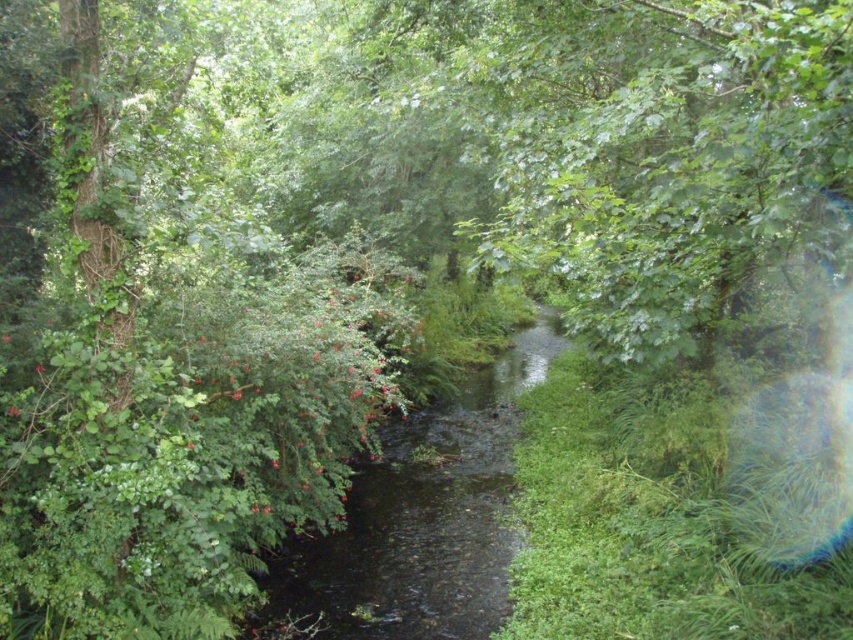
You are a gardener who needs to place a 5 meter long wooden bridge over the green leafy stream at center. You also want to ensure that the glossy red flower at left remains visible from the bridge. Can you do this without moving the flower?

The green leafy stream at center and glossy red flower at left are 5.16 meters apart. Since the bridge is 5 meters long, there will be a small gap of 0.16 meters between them, so the glossy red flower at left will still be visible from the bridge without needing to move it.

You are standing at point A located at point (351, 628). You want to walk to point B, which is 6.01 meters away. Is there a clear path between you and point B, considering the stream and surrounding vegetation?

The stream and surrounding vegetation may block the path between point A at point (351, 628) and point B, which is 6.01 meters away. However, the description does not provide specific details about obstacles between them, so it is uncertain if the path is clear.

You are a photographer standing at the edge of the stream in the scene. You want to take a photo that includes both the point at coordinates point (341, 509) and point (16, 406). Which point will appear closer to the bottom of the photo?

Point (16, 406) will appear closer to the bottom of the photo because it is closer to the camera than point (341, 509).